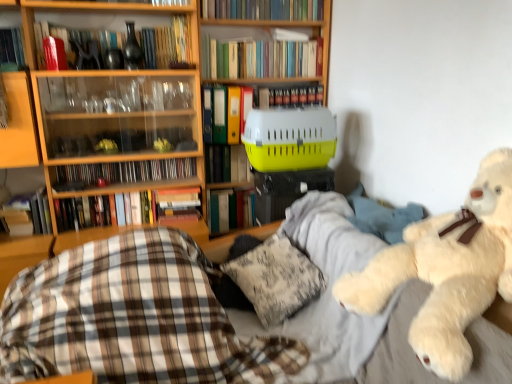
Question: From a real-world perspective, is wooden bookcase at upper left under yellow plastic crate at center, the fifth book from the bottom?

Choices:
 (A) yes
 (B) no

Answer: (B)

Question: Considering the relative positions of wooden bookcase at upper left and yellow plastic crate at center, the fifth book from the bottom, in the image provided, is wooden bookcase at upper left in front of yellow plastic crate at center, the fifth book from the bottom,?

Choices:
 (A) no
 (B) yes

Answer: (B)

Question: Is yellow plastic crate at center, which is the fifth book from top to bottom, located within wooden bookcase at upper left?

Choices:
 (A) no
 (B) yes

Answer: (A)

Question: Is wooden bookcase at upper left wider than yellow plastic crate at center, which is the fifth book from top to bottom?

Choices:
 (A) no
 (B) yes

Answer: (B)

Question: Can you confirm if wooden bookcase at upper left is bigger than yellow plastic crate at center, which is the fifth book from top to bottom?

Choices:
 (A) no
 (B) yes

Answer: (B)

Question: Based on their sizes in the image, would you say hardcover book at center, the 7th book when ordered from top to bottom, is bigger or smaller than yellow plastic pet carrier at center?

Choices:
 (A) small
 (B) big

Answer: (A)

Question: Relative to yellow plastic pet carrier at center, is hardcover book at center, the 7th book when ordered from top to bottom, in front or behind?

Choices:
 (A) behind
 (B) front

Answer: (A)

Question: Is point pyautogui.click(x=192, y=195) positioned closer to the camera than point pyautogui.click(x=320, y=152)?

Choices:
 (A) closer
 (B) farther

Answer: (B)

Question: From the image's perspective, relative to yellow plastic pet carrier at center, is hardcover book at center, marked as the third book in a bottom-to-top arrangement, above or below?

Choices:
 (A) below
 (B) above

Answer: (A)

Question: Is yellow plastic pet carrier at center inside the boundaries of hardcover book at center, arranged as the second book when ordered from the bottom, or outside?

Choices:
 (A) inside
 (B) outside

Answer: (B)

Question: From a real-world perspective, relative to hardcover book at center, positioned as the eighth book in top-to-bottom order, is yellow plastic pet carrier at center vertically above or below?

Choices:
 (A) above
 (B) below

Answer: (A)

Question: Is point (320, 127) positioned closer to the camera than point (212, 221)?

Choices:
 (A) closer
 (B) farther

Answer: (A)

Question: Considering the positions of yellow plastic pet carrier at center and hardcover book at center, arranged as the second book when ordered from the bottom, in the image, is yellow plastic pet carrier at center wider or thinner than hardcover book at center, arranged as the second book when ordered from the bottom,?

Choices:
 (A) wide
 (B) thin

Answer: (A)

Question: Is plaid fabric at lower left inside the boundaries of hardcover books at upper center, the seventh book ordered from the bottom, or outside?

Choices:
 (A) inside
 (B) outside

Answer: (B)

Question: Visually, is plaid fabric at lower left positioned to the left or to the right of hardcover books at upper center, positioned as the third book in top-to-bottom order?

Choices:
 (A) right
 (B) left

Answer: (B)